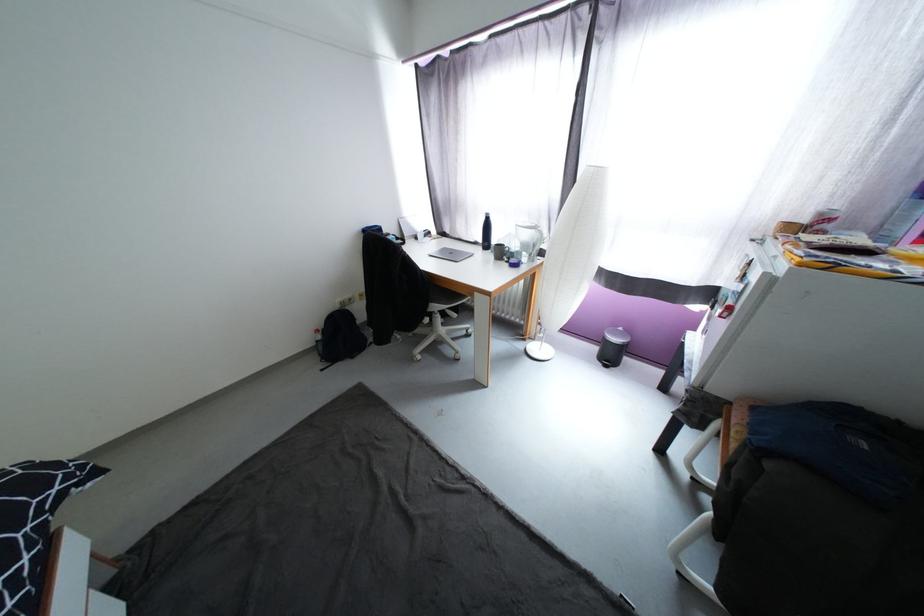
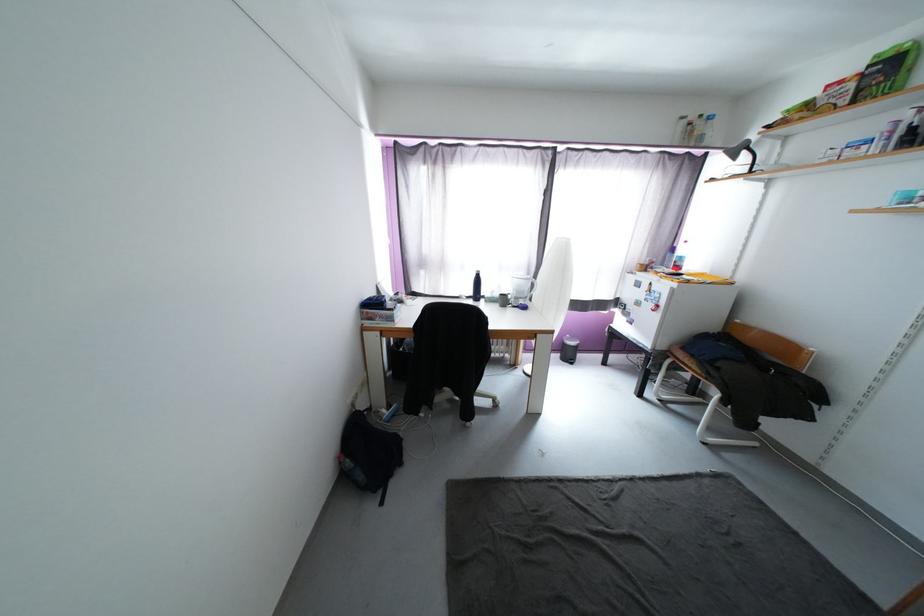
Where in the second image is the point corresponding to point (490, 220) from the first image?

(480, 277)